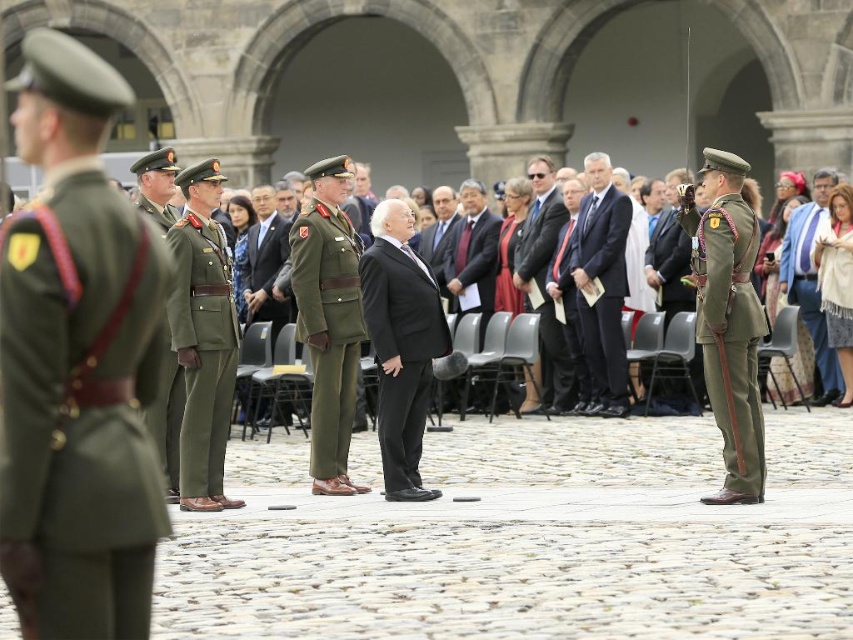
Question: Is matte green uniform at right to the right of black matte suit at center from the viewer's perspective?

Choices:
 (A) no
 (B) yes

Answer: (B)

Question: In this image, where is dark blue suit at center located relative to black smooth suit at center?

Choices:
 (A) below
 (B) above

Answer: (B)

Question: Which point appears closest to the camera in this image?

Choices:
 (A) (73, 454)
 (B) (428, 321)
 (C) (338, 324)
 (D) (732, 356)

Answer: (A)

Question: Which of these objects is positioned closest to the black matte suit at center?

Choices:
 (A) matte olive-green uniform at center
 (B) matte black suit at center
 (C) green woolen jacket at right

Answer: (A)

Question: Which of these objects is positioned farthest from the green matte uniform at center?

Choices:
 (A) matte green uniform at center
 (B) matte olive-green uniform at center
 (C) matte black suit at center

Answer: (C)

Question: Does green fabric uniform at left appear on the right side of green matte uniform at center?

Choices:
 (A) no
 (B) yes

Answer: (A)